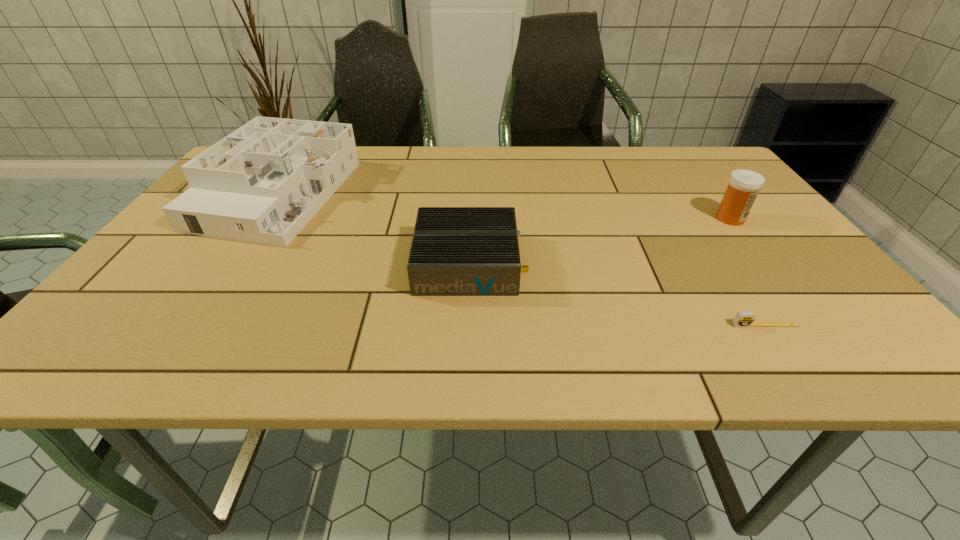
Image resolution: width=960 pixels, height=540 pixels. In order to click on vacant position at the near right corner of the desktop in this screenshot , I will do `click(840, 334)`.

Find the location of a particular element. The image size is (960, 540). free spot between the medicine and the second shortest object is located at coordinates (599, 241).

This screenshot has width=960, height=540. What are the coordinates of `free area in between the second shortest object and the leftmost object` in the screenshot? It's located at (372, 229).

Where is `blank region between the router and the medicine`? This screenshot has height=540, width=960. blank region between the router and the medicine is located at coordinates (599, 241).

Find the location of a particular element. This screenshot has height=540, width=960. vacant point located between the medicine and the nearest object is located at coordinates (748, 272).

The image size is (960, 540). Identify the location of free spot between the shortest object and the third tallest object. (616, 294).

Find the location of a particular element. This screenshot has width=960, height=540. free spot between the router and the medicine is located at coordinates (599, 241).

Locate an element on the screen. This screenshot has height=540, width=960. free space between the shortest object and the router is located at coordinates (616, 294).

This screenshot has height=540, width=960. Find the location of `unoccupied position between the dollhouse and the router`. unoccupied position between the dollhouse and the router is located at coordinates (372, 229).

Locate an element on the screen. free space between the third object from right to left and the dollhouse is located at coordinates (372, 229).